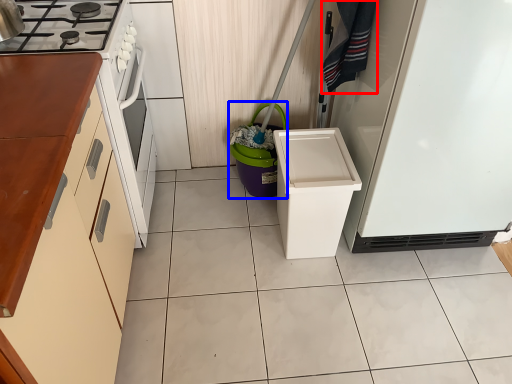
Question: Among these objects, which one is farthest to the camera, laundry (highlighted by a red box) or appliance (highlighted by a blue box)?

Choices:
 (A) laundry
 (B) appliance

Answer: (B)